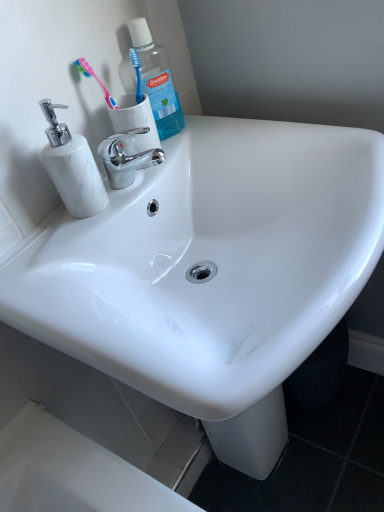
Question: From the image's perspective, is pink plastic toothbrush at upper left above or below white marble soap dispenser at left?

Choices:
 (A) above
 (B) below

Answer: (A)

Question: Is pink plastic toothbrush at upper left inside or outside of white marble soap dispenser at left?

Choices:
 (A) inside
 (B) outside

Answer: (B)

Question: Which of these objects is positioned closest to the blue translucent plastic mouthwash at upper left?

Choices:
 (A) pink plastic toothbrush at upper left
 (B) white glossy sink at center
 (C) chrome/metallic faucet at center
 (D) white marble soap dispenser at left

Answer: (A)

Question: Estimate the real-world distances between objects in this image. Which object is closer to the chrome/metallic faucet at center?

Choices:
 (A) white glossy sink at center
 (B) blue translucent plastic mouthwash at upper left
 (C) pink plastic toothbrush at upper left
 (D) white marble soap dispenser at left

Answer: (D)